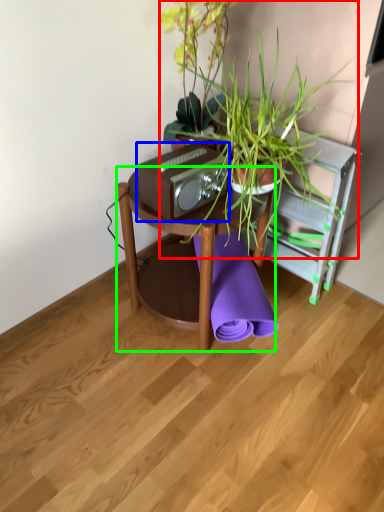
Question: Which is farther away from houseplant (highlighted by a red box)? stereo (highlighted by a blue box) or table (highlighted by a green box)?

Choices:
 (A) stereo
 (B) table

Answer: (B)